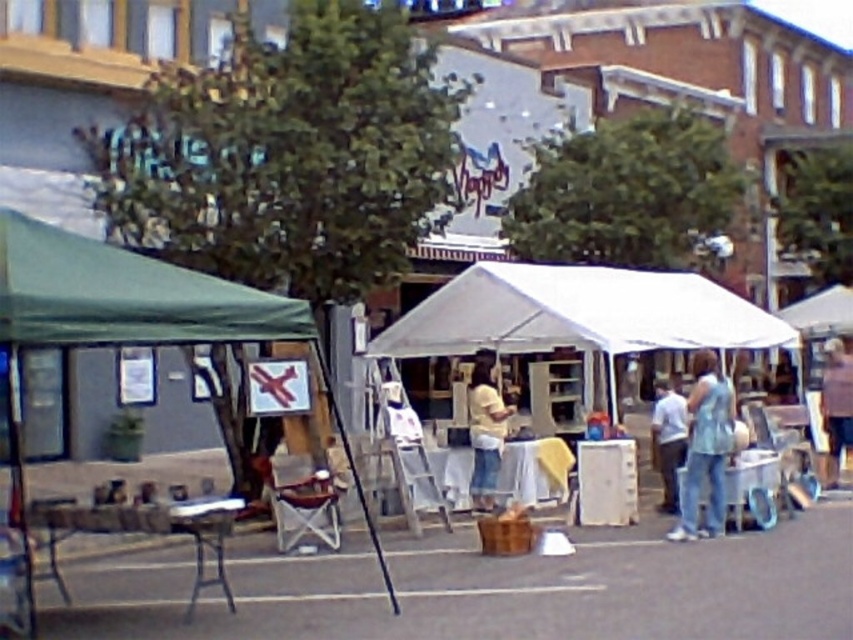
Question: Which object is positioned farthest from the white fabric canopy at center?

Choices:
 (A) yellow cotton shirt at center
 (B) brown fabric jacket at upper right
 (C) light blue denim jeans at lower right
 (D) white cotton shirt at center

Answer: (D)

Question: Is green fabric canopy at left positioned at the back of brown fabric jacket at upper right?

Choices:
 (A) yes
 (B) no

Answer: (B)

Question: Which point is closer to the camera?

Choices:
 (A) brown fabric jacket at upper right
 (B) light blue denim jeans at lower right
 (C) yellow cotton shirt at center
 (D) green fabric canopy at left

Answer: (D)

Question: Which point appears closest to the camera in this image?

Choices:
 (A) (468, 410)
 (B) (148, 314)

Answer: (B)

Question: Is green fabric canopy at left smaller than light blue denim jeans at lower right?

Choices:
 (A) yes
 (B) no

Answer: (B)

Question: Does light blue denim jeans at lower right have a greater width compared to yellow cotton shirt at center?

Choices:
 (A) yes
 (B) no

Answer: (B)